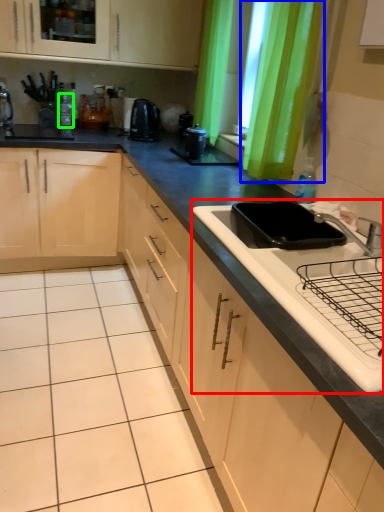
Question: Estimate the real-world distances between objects in this image. Which object is farther from sink (highlighted by a red box), curtain (highlighted by a blue box) or bottle (highlighted by a green box)?

Choices:
 (A) curtain
 (B) bottle

Answer: (B)